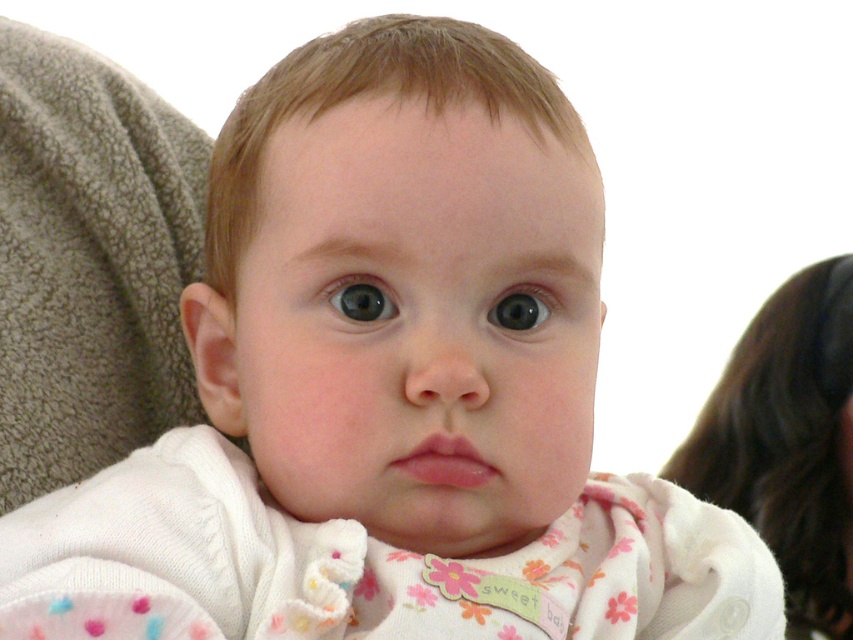
You are a photographer adjusting the lighting for a baby photo shoot. You notice the white soft fabric at upper right and the blue glossy eye at center in the image. Which object should you focus the light on to ensure it captures the texture details better?

The white soft fabric at upper right should be focused on because it is wider than the blue glossy eye at center, allowing for better texture detail capture.

You are a photographer adjusting lighting for a baby photo shoot. You notice the blue glossy eye at center and the shiny black eye at center in the image. Which eye should you focus on to ensure proper exposure, considering their sizes?

The blue glossy eye at center has a greater height compared to the shiny black eye at center, so focusing on the larger blue glossy eye at center would ensure proper exposure as it occupies more visual space.

You are a photographer adjusting the lighting for a baby photo shoot. You notice the blue glossy eye at center and the shiny black eye at center in the frame. Which eye should you adjust the light to highlight more, considering their positions?

The blue glossy eye at center is to the left of the shiny black eye at center. Since the blue glossy eye is positioned on the left, you should adjust the light to highlight the shiny black eye at center as it is on the right side, ensuring balanced lighting across both eyes.